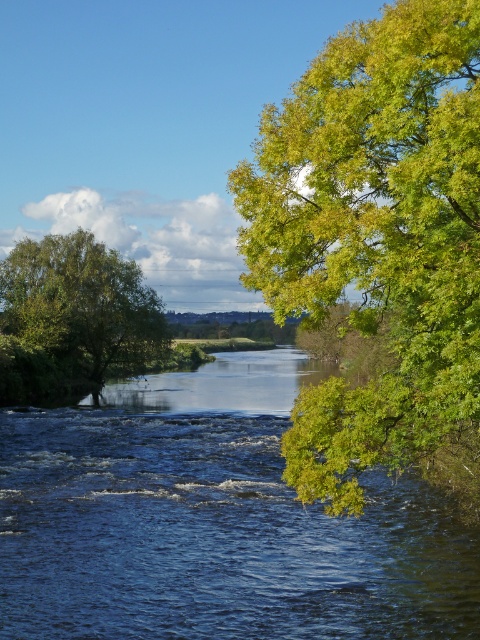
Question: Which point appears farthest from the camera in this image?

Choices:
 (A) (396, 120)
 (B) (287, 564)

Answer: (B)

Question: Estimate the real-world distances between objects in this image. Which object is farther from the green leafy tree at right?

Choices:
 (A) green leafy tree at left
 (B) blue water at center

Answer: (A)

Question: Is blue water at center below green leafy tree at left?

Choices:
 (A) no
 (B) yes

Answer: (B)

Question: Does blue water at center appear on the left side of green leafy tree at right?

Choices:
 (A) yes
 (B) no

Answer: (A)

Question: Among these objects, which one is farthest from the camera?

Choices:
 (A) green leafy tree at left
 (B) green leafy tree at right

Answer: (A)

Question: Can you confirm if green leafy tree at right is bigger than green leafy tree at left?

Choices:
 (A) yes
 (B) no

Answer: (B)